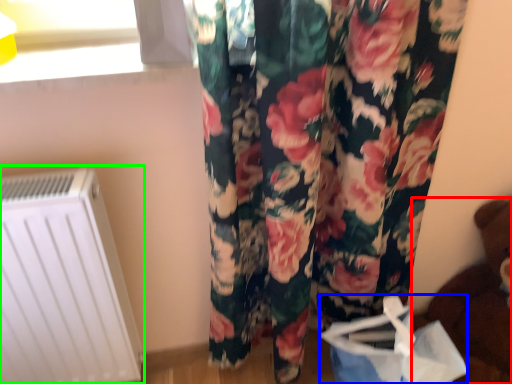
Question: Which object is positioned closest to toy (highlighted by a red box)? Select from shopping bag (highlighted by a blue box) and radiator (highlighted by a green box).

Choices:
 (A) shopping bag
 (B) radiator

Answer: (A)